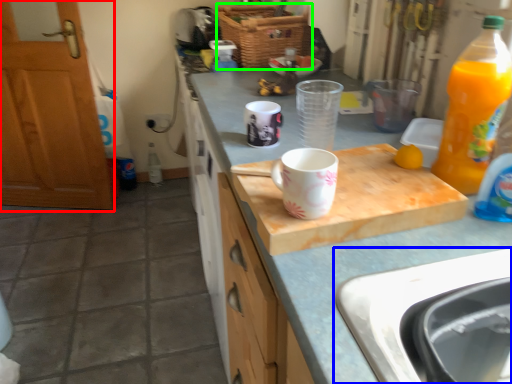
Question: Considering the real-world distances, which object is closest to cabinetry (highlighted by a red box)? sink (highlighted by a blue box) or basket (highlighted by a green box).

Choices:
 (A) sink
 (B) basket

Answer: (B)